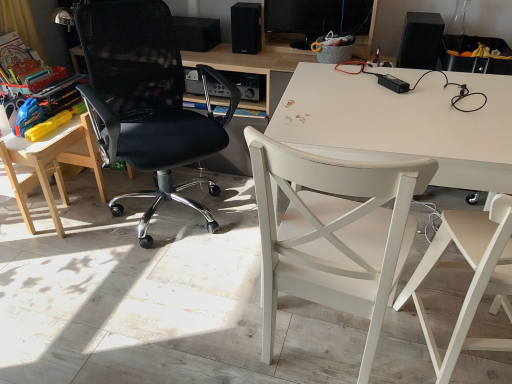
Question: Based on their sizes in the image, would you say white wood chair at right, placed as the 4th chair when sorted from left to right, is bigger or smaller than black mesh office chair at left, positioned as the 3th chair in right-to-left order?

Choices:
 (A) small
 (B) big

Answer: (A)

Question: In terms of height, does white wood chair at right, placed as the 4th chair when sorted from left to right, look taller or shorter compared to black mesh office chair at left, positioned as the 3th chair in right-to-left order?

Choices:
 (A) short
 (B) tall

Answer: (A)

Question: Considering the real-world distances, which object is farthest from the light wood/wooden chair at left, the 4th chair from the right?

Choices:
 (A) white wood chair at right, placed as the 4th chair when sorted from left to right
 (B) black matte speaker at upper right, which is the first loudspeaker from right to left
 (C) wooden table at left
 (D) black mesh office chair at left, positioned as the 3th chair in right-to-left order
 (E) black matte speaker at upper center, positioned as the second loudspeaker in left-to-right order

Answer: (B)

Question: Considering the real-world distances, which object is farthest from the light wood/wooden chair at left, the 4th chair from the right?

Choices:
 (A) black matte speaker at upper center, positioned as the second loudspeaker in left-to-right order
 (B) wooden table at left
 (C) black matte speaker at upper center, arranged as the first loudspeaker when viewed from the left
 (D) black matte speaker at upper right, which is the first loudspeaker from right to left
 (E) white wood chair at right, which appears as the first chair when viewed from the right

Answer: (D)